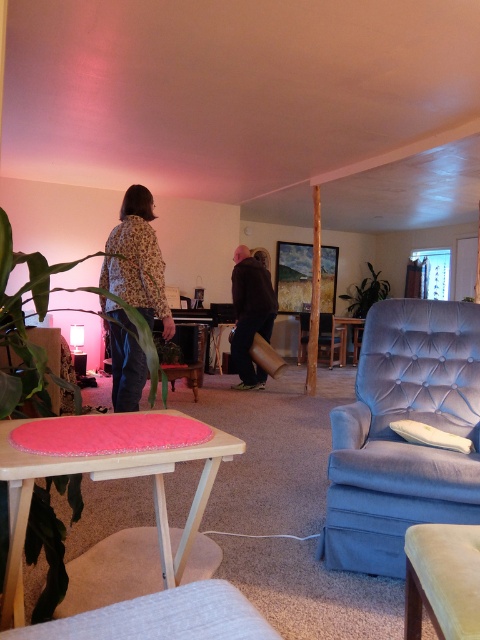
You are sitting on the velvet blue armchair at center and want to move to the green plastic stool at center. Since both are at the center, which direction should you move to reach the stool?

The velvet blue armchair at center is wider than the green plastic stool at center, so you should move to the right or left to reach the green plastic stool at center since both are positioned centrally but the stool is narrower.

You are arranging flowers in the living room and need to place a bouquet between the pink felt table at lower left and the pink felt table at center. Which table should you place the bouquet closer to if you want it to be higher up?

The pink felt table at center is higher than the pink felt table at lower left, so place the bouquet closer to the pink felt table at center to achieve a higher placement.